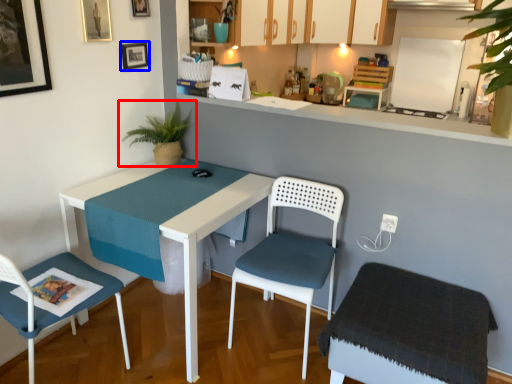
Question: Which of the following is the farthest to the observer, houseplant (highlighted by a red box) or picture frame (highlighted by a blue box)?

Choices:
 (A) houseplant
 (B) picture frame

Answer: (B)